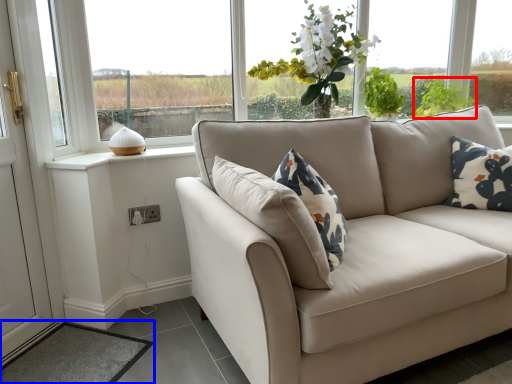
Question: Which point is further to the camera, plant (highlighted by a red box) or mat (highlighted by a blue box)?

Choices:
 (A) plant
 (B) mat

Answer: (A)